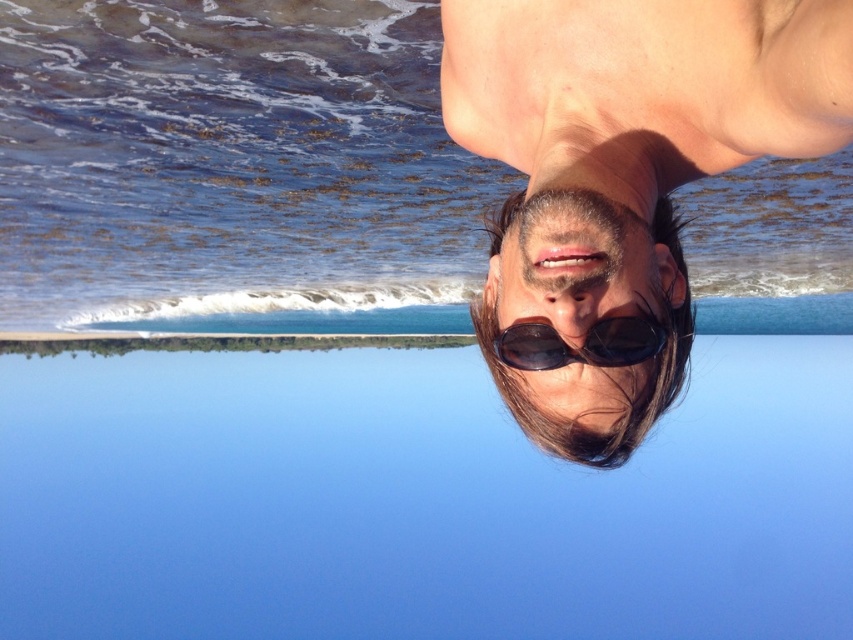
Question: Does blue water at upper center lie in front of clear blue water at upper center?

Choices:
 (A) yes
 (B) no

Answer: (B)

Question: Considering the relative positions of blue water at upper center and clear blue water at upper center in the image provided, where is blue water at upper center located with respect to clear blue water at upper center?

Choices:
 (A) above
 (B) below

Answer: (B)

Question: Which object is positioned farthest from the matte black sunglasses at upper right?

Choices:
 (A) clear blue water at upper center
 (B) blue water at upper center
 (C) sunglasses at center
 (D) black reflective sunglasses at bottom

Answer: (B)

Question: Which of the following is the farthest from the observer?

Choices:
 (A) blue water at upper center
 (B) sunglasses at center

Answer: (A)

Question: Among these objects, which one is nearest to the camera?

Choices:
 (A) sunglasses at center
 (B) matte black sunglasses at upper right
 (C) blue water at upper center
 (D) clear blue water at upper center

Answer: (B)

Question: Can you confirm if matte black sunglasses at upper right is positioned above sunglasses at center?

Choices:
 (A) yes
 (B) no

Answer: (A)